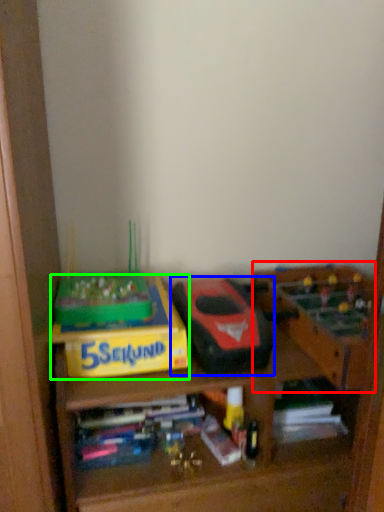
Question: Considering the real-world distances, which object is farthest from toy (highlighted by a red box)? toy (highlighted by a blue box) or cardboard box (highlighted by a green box)?

Choices:
 (A) toy
 (B) cardboard box

Answer: (B)